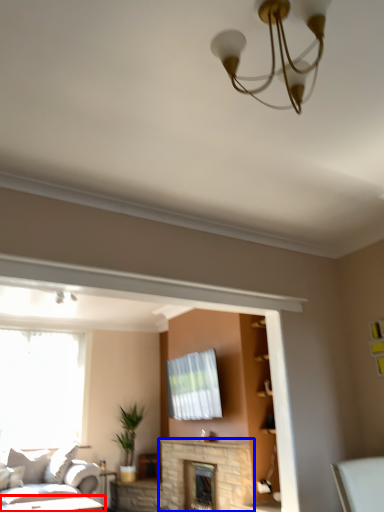
Question: Which of the following is the farthest to the observer, table (highlighted by a red box) or fireplace (highlighted by a blue box)?

Choices:
 (A) table
 (B) fireplace

Answer: (B)